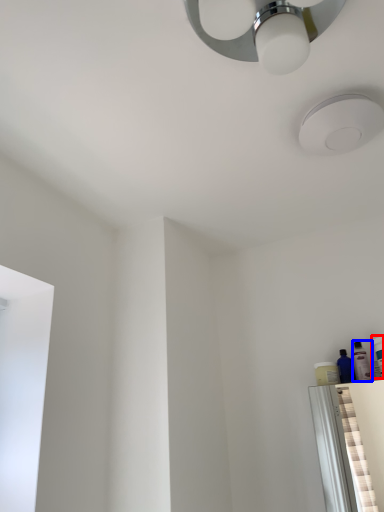
Question: Which point is closer to the camera, toiletry (highlighted by a red box) or toiletry (highlighted by a blue box)?

Choices:
 (A) toiletry
 (B) toiletry

Answer: (A)